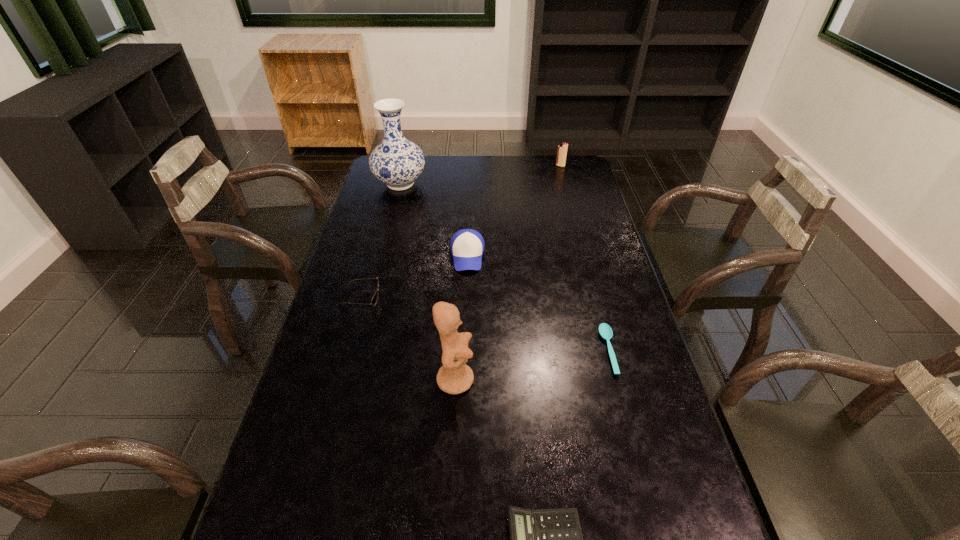
Identify the location of unoccupied area between the igniter and the figurine. (508, 273).

This screenshot has width=960, height=540. In order to click on object that is the third nearest to the fourth shortest object in this screenshot , I will do `click(454, 377)`.

Image resolution: width=960 pixels, height=540 pixels. What are the coordinates of `object that is the fifth closest to the vase` in the screenshot? It's located at coord(605,330).

You are a GUI agent. You are given a task and a screenshot of the screen. Output one action in this format:
    pyautogui.click(x=<x>, y=<y>)
    Task: Click on the free location that satisfies the following two spatial constraints: 1. on the front-facing side of the baseball cap; 2. on the right side of the shortest object
    The width and height of the screenshot is (960, 540).
    Given the screenshot: What is the action you would take?
    pyautogui.click(x=465, y=350)

Image resolution: width=960 pixels, height=540 pixels. Identify the location of blank area in the image that satisfies the following two spatial constraints: 1. on the front-facing side of the fourth shortest object; 2. on the front-facing side of the sunglasses. (467, 297).

Find the location of a particular element. The image size is (960, 540). free point that satisfies the following two spatial constraints: 1. on the front-facing side of the fourth shortest object; 2. on the left side of the shortest object is located at coordinates (465, 350).